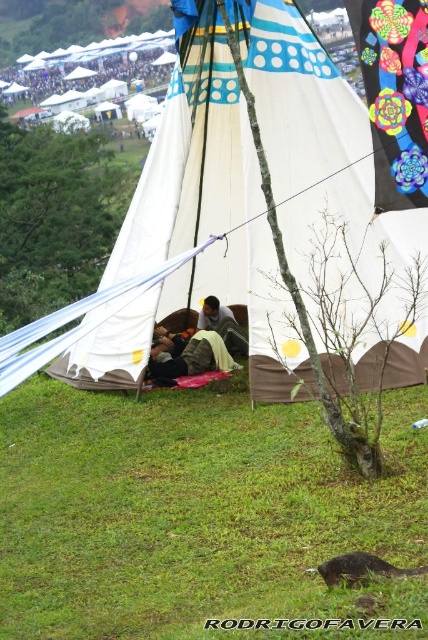
Question: Does camouflage fabric sleeping bag at center come in front of camouflage fabric person at center?

Choices:
 (A) no
 (B) yes

Answer: (B)

Question: Which point is closer to the camera?

Choices:
 (A) camouflage fabric person at center
 (B) white canvas tent at center
 (C) green grass at lower center
 (D) camouflage fabric sleeping bag at center

Answer: (C)

Question: Which object appears farthest from the camera in this image?

Choices:
 (A) camouflage fabric sleeping bag at center
 (B) green grass at lower center
 (C) white canvas tent at center

Answer: (A)

Question: Considering the real-world distances, which object is closest to the camouflage fabric sleeping bag at center?

Choices:
 (A) green grass at lower center
 (B) camouflage fabric person at center

Answer: (B)

Question: Observing the image, what is the correct spatial positioning of green grass at lower center in reference to camouflage fabric person at center?

Choices:
 (A) right
 (B) left

Answer: (A)

Question: Observing the image, what is the correct spatial positioning of green grass at lower center in reference to camouflage fabric person at center?

Choices:
 (A) right
 (B) left

Answer: (A)